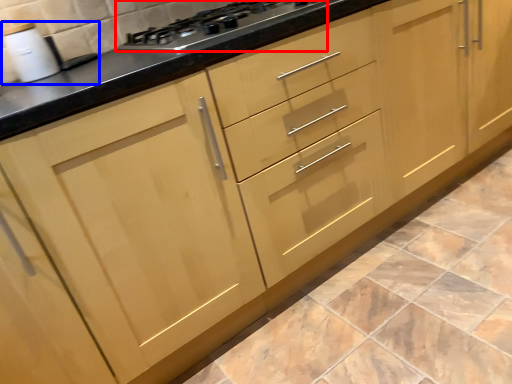
Question: Among these objects, which one is nearest to the camera, gas stove (highlighted by a red box) or sink (highlighted by a blue box)?

Choices:
 (A) gas stove
 (B) sink

Answer: (A)